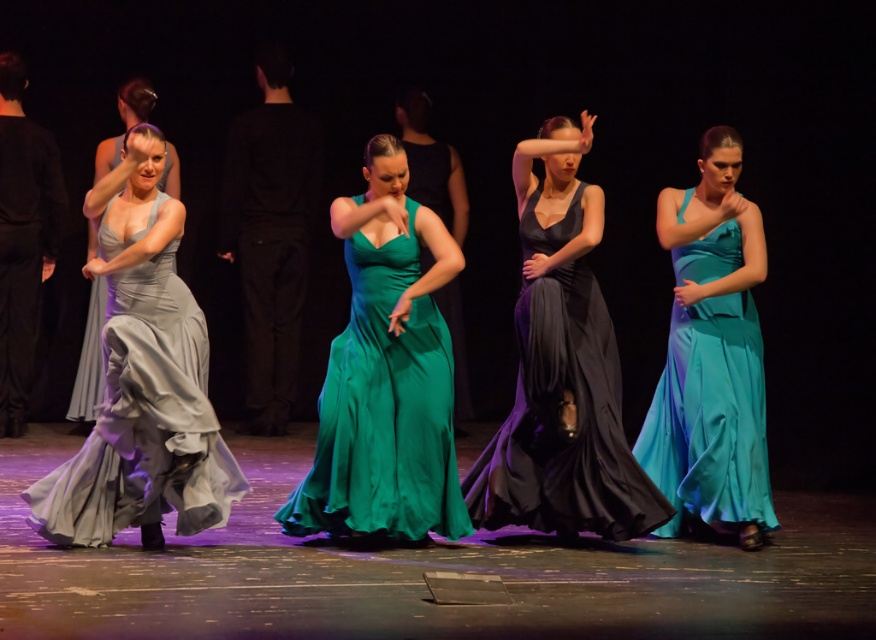
Question: Is emerald satin dress at center above green satin dress at center?

Choices:
 (A) no
 (B) yes

Answer: (A)

Question: Is the position of matte black dress at center less distant than that of satin silver dress at left?

Choices:
 (A) yes
 (B) no

Answer: (A)

Question: Is satin gray dress at left bigger than green satin dress at center?

Choices:
 (A) no
 (B) yes

Answer: (B)

Question: Which of these objects is positioned farthest from the satin silver dress at left?

Choices:
 (A) emerald satin dress at center
 (B) matte black dress at center

Answer: (B)

Question: Which point is farther to the camera?

Choices:
 (A) (549, 417)
 (B) (682, 337)
 (C) (460, 328)
 (D) (154, 301)

Answer: (C)

Question: Which point appears farthest from the camera in this image?

Choices:
 (A) click(x=104, y=298)
 (B) click(x=102, y=257)
 (C) click(x=396, y=336)
 (D) click(x=580, y=452)

Answer: (A)